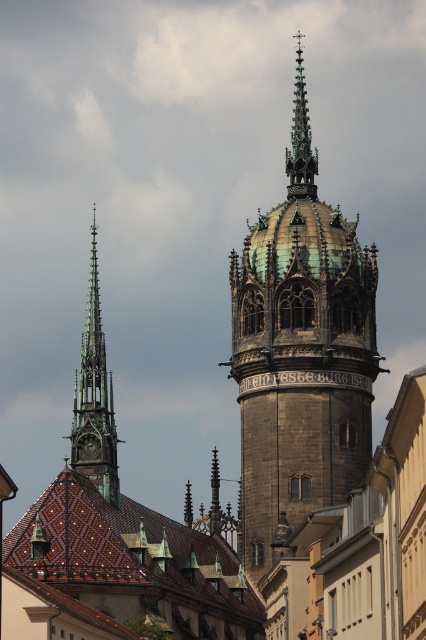
Question: Which point is farther to the camera?

Choices:
 (A) (284, 241)
 (B) (293, 120)
 (C) (77, 449)

Answer: (B)

Question: Is green copper spire at left above polished copper spire at upper center?

Choices:
 (A) no
 (B) yes

Answer: (A)

Question: Does green copper spire at left have a lesser width compared to polished copper spire at upper center?

Choices:
 (A) no
 (B) yes

Answer: (A)

Question: Among these objects, which one is farthest from the camera?

Choices:
 (A) green copper spire at left
 (B) dark brown stone tower at center
 (C) polished copper spire at upper center

Answer: (C)

Question: Which of the following is the closest to the observer?

Choices:
 (A) click(310, 173)
 (B) click(89, 381)
 (C) click(307, 264)

Answer: (B)

Question: Can you confirm if green copper spire at left is thinner than polished copper spire at upper center?

Choices:
 (A) yes
 (B) no

Answer: (B)